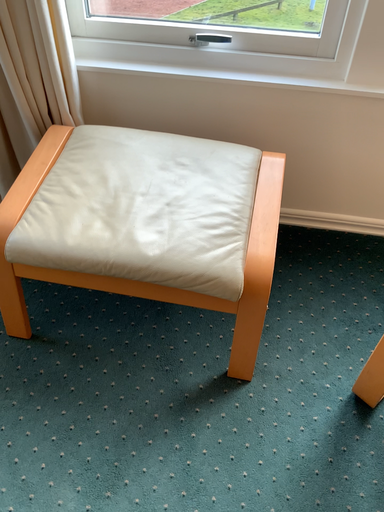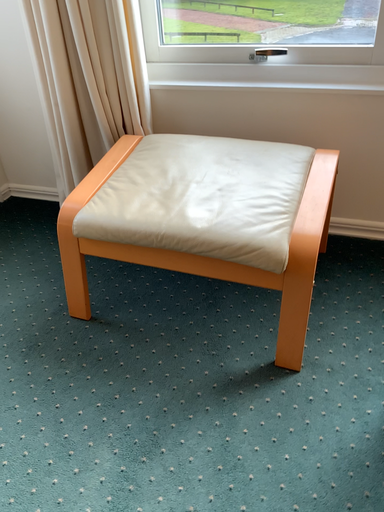
Question: Which way did the camera rotate in the video?

Choices:
 (A) rotated right
 (B) rotated left

Answer: (B)